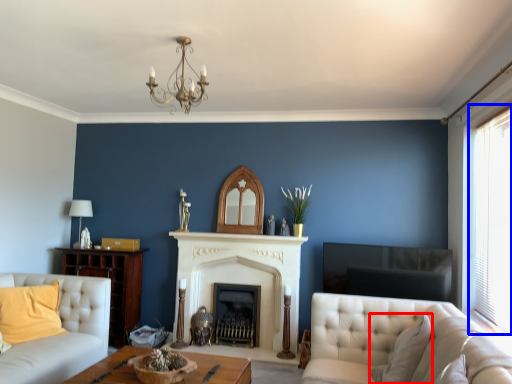
Question: Among these objects, which one is farthest to the camera, pillow (highlighted by a red box) or window (highlighted by a blue box)?

Choices:
 (A) pillow
 (B) window

Answer: (B)